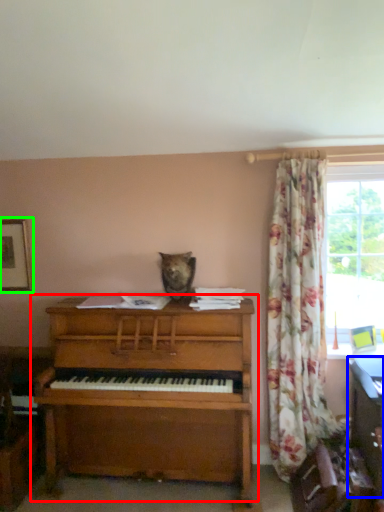
Question: Which object is the closest to the piano (highlighted by a red box)? Choose among these: computer desk (highlighted by a blue box) or picture frame (highlighted by a green box).

Choices:
 (A) computer desk
 (B) picture frame

Answer: (B)